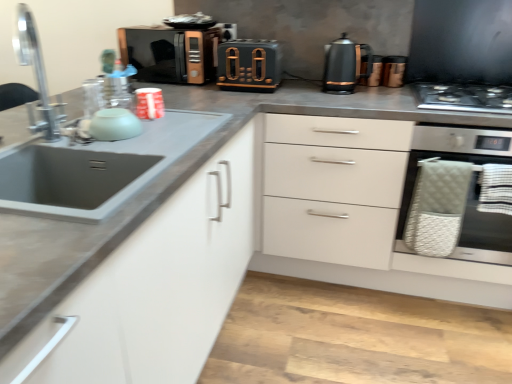
The image size is (512, 384). What are the coordinates of `matte black toaster at center, which ranks as the third appliance in right-to-left order` in the screenshot? It's located at (249, 65).

Describe the element at coordinates (249, 65) in the screenshot. I see `matte black toaster at center, which appears as the 4th appliance when viewed from the back` at that location.

What is the approximate width of white matte cabinet at left?

It is 36.86 inches.

This screenshot has width=512, height=384. What are the coordinates of `stainless steel oven at right` in the screenshot? It's located at (450, 156).

In order to face stainless steel gas stove at right, should I rotate leftwards or rightwards?

It's best to rotate right around 26.663 degrees.

Measure the distance between stainless steel gas stove at right and camera.

1.61 meters.

Locate an element on the screen. The width and height of the screenshot is (512, 384). matte black toaster at center, which ranks as the third appliance in right-to-left order is located at coordinates (249, 65).

From a real-world perspective, who is located higher, white matte cabinet at left or matte black microwave at upper center, the 2th appliance in the left-to-right sequence?

matte black microwave at upper center, the 2th appliance in the left-to-right sequence, is physically above.

From the white matte cabinet at left, count 2nd appliance to the right and point to it. Please provide its 2D coordinates.

[(169, 54)]

Looking at this image, considering the relative positions of white matte cabinet at left and matte black microwave at upper center, the 2th appliance in the left-to-right sequence, in the image provided, is white matte cabinet at left behind matte black microwave at upper center, the 2th appliance in the left-to-right sequence,?

No, it is in front of matte black microwave at upper center, the 2th appliance in the left-to-right sequence.

Would you say white matte cabinet at left contains matte black microwave at upper center, the 2th appliance in the left-to-right sequence?

No, matte black microwave at upper center, the 2th appliance in the left-to-right sequence, is not inside white matte cabinet at left.

Looking at this image, how many degrees apart are the facing directions of stainless steel oven at right and matte green bowl at left, the fifth appliance when ordered from right to left?

stainless steel oven at right and matte green bowl at left, the fifth appliance when ordered from right to left, are facing 90 degrees away from each other.

From the image's perspective, is stainless steel oven at right located beneath matte green bowl at left, which ranks as the first appliance in front-to-back order?

Indeed, from the image's perspective, stainless steel oven at right is shown beneath matte green bowl at left, which ranks as the first appliance in front-to-back order.

Can you confirm if stainless steel oven at right is smaller than matte green bowl at left, the fifth appliance when ordered from right to left?

Incorrect, stainless steel oven at right is not smaller in size than matte green bowl at left, the fifth appliance when ordered from right to left.

Looking at this image, is stainless steel oven at right not near matte green bowl at left, which ranks as the first appliance in front-to-back order?

Yes, stainless steel oven at right is far from matte green bowl at left, which ranks as the first appliance in front-to-back order.

Can you confirm if metallic copper kettle at upper right, the second appliance from the back, is positioned to the left of stainless steel oven at right?

Correct, you'll find metallic copper kettle at upper right, the second appliance from the back, to the left of stainless steel oven at right.

Is metallic copper kettle at upper right, placed as the first appliance when sorted from right to left, not within stainless steel oven at right?

metallic copper kettle at upper right, placed as the first appliance when sorted from right to left, lies outside stainless steel oven at right's area.

Is metallic copper kettle at upper right, the second appliance from the back, not close to stainless steel oven at right?

Actually, metallic copper kettle at upper right, the second appliance from the back, and stainless steel oven at right are a little close together.

From a real-world perspective, between metallic copper kettle at upper right, placed as the first appliance when sorted from right to left, and stainless steel oven at right, who is vertically lower?

In real-world perspective, stainless steel oven at right is lower.

What are the coordinates of `basket that is below the metallic copper kettle at upper right, which is counted as the fifth appliance, starting from the left (from the image's perspective)` in the screenshot? It's located at (437, 206).

Which of these two, metallic copper kettle at upper right, the second appliance from the back, or quilted fabric basket at lower right, is smaller?

Smaller between the two is metallic copper kettle at upper right, the second appliance from the back.

Is metallic copper kettle at upper right, which ranks as the fourth appliance in front-to-back order, oriented towards quilted fabric basket at lower right?

No, metallic copper kettle at upper right, which ranks as the fourth appliance in front-to-back order, does not turn towards quilted fabric basket at lower right.

Which is in front, quilted fabric basket at lower right or matte black kettle at upper right?

Positioned in front is quilted fabric basket at lower right.

Is quilted fabric basket at lower right with matte black kettle at upper right?

quilted fabric basket at lower right and matte black kettle at upper right are clearly separated.

Is quilted fabric basket at lower right at the left side of matte black kettle at upper right?

No.

Considering the positions of point (416, 208) and point (202, 39), is point (416, 208) closer or farther from the camera than point (202, 39)?

Point (416, 208).

Considering the sizes of quilted fabric basket at lower right and matte black microwave at upper center, the fourth appliance positioned from the right, in the image, is quilted fabric basket at lower right taller or shorter than matte black microwave at upper center, the fourth appliance positioned from the right,?

Clearly, quilted fabric basket at lower right is taller compared to matte black microwave at upper center, the fourth appliance positioned from the right.

Which object is further away from the camera, quilted fabric basket at lower right or matte black microwave at upper center, the fourth appliance positioned from the right?

Positioned behind is matte black microwave at upper center, the fourth appliance positioned from the right.

How much distance is there between quilted fabric basket at lower right and matte black microwave at upper center, the fourth appliance positioned from the right?

A distance of 1.27 meters exists between quilted fabric basket at lower right and matte black microwave at upper center, the fourth appliance positioned from the right.

From the image's perspective, is stainless steel gas stove at right on matte green bowl at left, which is counted as the fifth appliance, starting from the back?

Indeed, from the image's perspective, stainless steel gas stove at right is shown above matte green bowl at left, which is counted as the fifth appliance, starting from the back.

From the picture: From a real-world perspective, is stainless steel gas stove at right located higher than matte green bowl at left, placed as the first appliance when sorted from left to right?

No, from a real-world perspective, stainless steel gas stove at right is not on top of matte green bowl at left, placed as the first appliance when sorted from left to right.

Considering the sizes of objects stainless steel gas stove at right and matte green bowl at left, which ranks as the first appliance in front-to-back order, in the image provided, who is wider, stainless steel gas stove at right or matte green bowl at left, which ranks as the first appliance in front-to-back order,?

stainless steel gas stove at right.

Relative to matte green bowl at left, the fifth appliance when ordered from right to left, is stainless steel gas stove at right in front or behind?

Clearly, stainless steel gas stove at right is behind matte green bowl at left, the fifth appliance when ordered from right to left.

Which appliance is the 2nd one when counting from the right side of the white matte cabinet at left? Please provide its 2D coordinates.

[(169, 54)]

I want to click on home appliance below the matte green bowl at left, which is counted as the fifth appliance, starting from the back (from a real-world perspective), so click(x=450, y=156).

Consider the image. Considering their positions, is stainless steel oven at right positioned further to metallic copper kettle at upper right, which ranks as the fourth appliance in front-to-back order, than copper metallic toaster at center, acting as the fourth appliance starting from the left?

Among the two, stainless steel oven at right is located further to metallic copper kettle at upper right, which ranks as the fourth appliance in front-to-back order.

From the image, which object appears to be nearer to quilted fabric basket at lower right, metallic copper kettle at upper right, which is counted as the fifth appliance, starting from the left, or stainless steel gas stove at right?

The object closer to quilted fabric basket at lower right is stainless steel gas stove at right.

Based on their spatial positions, is matte black toaster at center, which appears as the 4th appliance when viewed from the back, or stainless steel gas stove at right further from stainless steel oven at right?

Based on the image, matte black toaster at center, which appears as the 4th appliance when viewed from the back, appears to be further to stainless steel oven at right.

Based on their spatial positions, is matte black microwave at upper center, which is the third appliance from front to back, or silver metallic faucet at left closer to matte black kettle at upper right?

matte black microwave at upper center, which is the third appliance from front to back.

In the scene shown: From the image, which object appears to be nearer to metallic copper kettle at upper right, placed as the first appliance when sorted from right to left, stainless steel gas stove at right or quilted fabric basket at lower right?

Based on the image, stainless steel gas stove at right appears to be nearer to metallic copper kettle at upper right, placed as the first appliance when sorted from right to left.

When comparing their distances from stainless steel oven at right, does stainless steel gas stove at right or matte green bowl at left, which is counted as the fifth appliance, starting from the back, seem closer?

The object closer to stainless steel oven at right is stainless steel gas stove at right.

Estimate the real-world distances between objects in this image. Which object is further from matte black microwave at upper center, which is the third appliance from front to back, stainless steel gas stove at right or matte black toaster at center, which appears as the 4th appliance when viewed from the back?

stainless steel gas stove at right lies further to matte black microwave at upper center, which is the third appliance from front to back, than the other object.

Which object lies further to the anchor point matte black kettle at upper right, silver metallic faucet at left or metallic copper kettle at upper right, the second appliance from the back?

Based on the image, silver metallic faucet at left appears to be further to matte black kettle at upper right.

Locate an element on the screen. faucet positioned between white matte cabinet at left and copper metallic toaster at center, acting as the fourth appliance starting from the left, from near to far is located at coordinates (37, 76).

The image size is (512, 384). I want to click on kitchen appliance between matte green bowl at left, the fifth appliance when ordered from right to left, and metallic copper kettle at upper right, placed as the first appliance when sorted from right to left, from left to right, so click(x=344, y=65).

The width and height of the screenshot is (512, 384). I want to click on appliance between matte black microwave at upper center, the fourth appliance positioned from the right, and copper metallic toaster at center, which is the 2th appliance from right to left, in the horizontal direction, so click(x=249, y=65).

Locate an element on the screen. Image resolution: width=512 pixels, height=384 pixels. kitchen appliance between copper metallic toaster at center, acting as the fourth appliance starting from the left, and quilted fabric basket at lower right in the up-down direction is located at coordinates (344, 65).